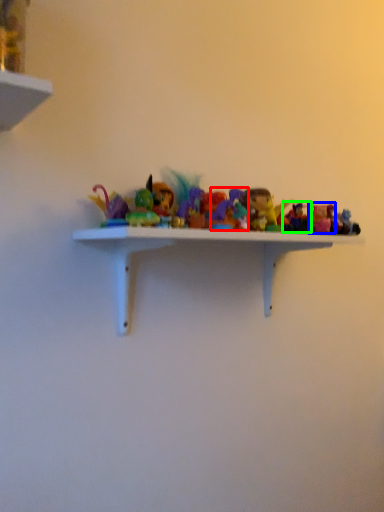
Question: Estimate the real-world distances between objects in this image. Which object is farther from toy (highlighted by a red box), toy (highlighted by a blue box) or toy (highlighted by a green box)?

Choices:
 (A) toy
 (B) toy

Answer: (A)